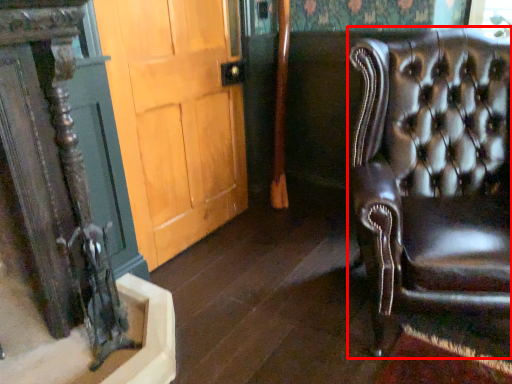
Question: From the image's perspective, what is the correct spatial positioning of chair (annotated by the red box) in reference to door?

Choices:
 (A) below
 (B) above

Answer: (A)